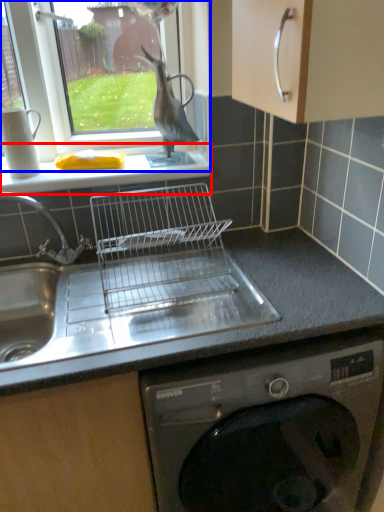
Question: Which point is closer to the camera, window sill (highlighted by a red box) or window (highlighted by a blue box)?

Choices:
 (A) window sill
 (B) window

Answer: (B)